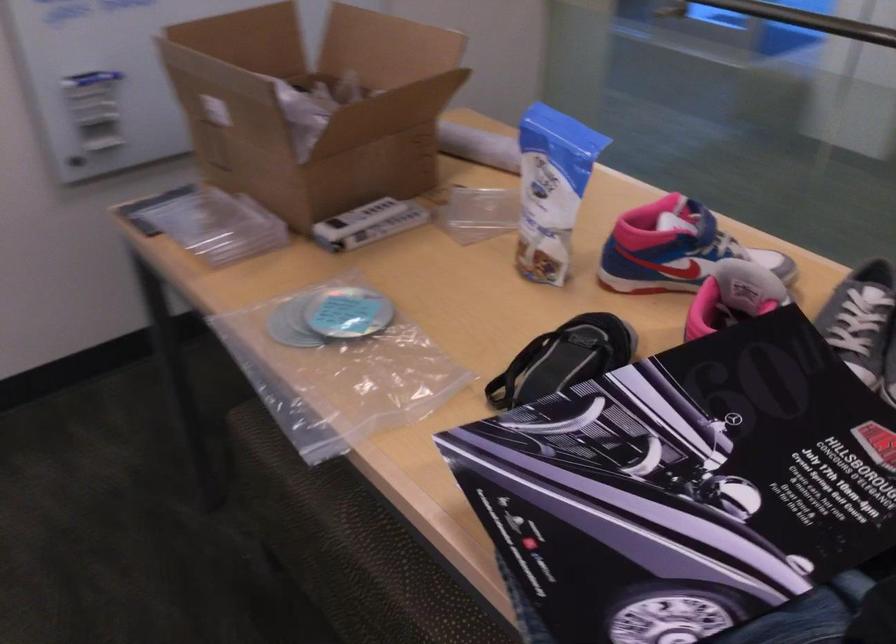
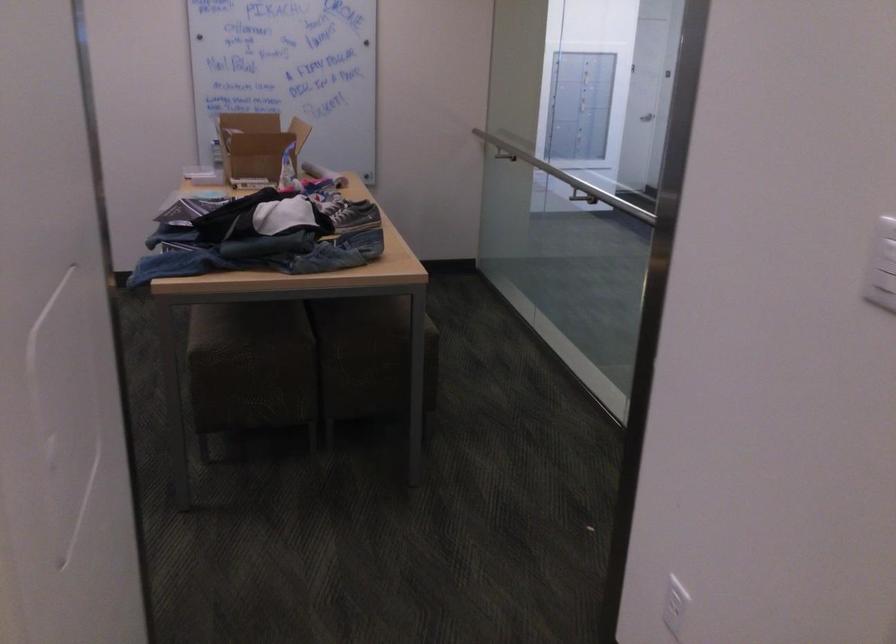
Find the pixel in the second image that matches point (401, 152) in the first image.

(256, 146)